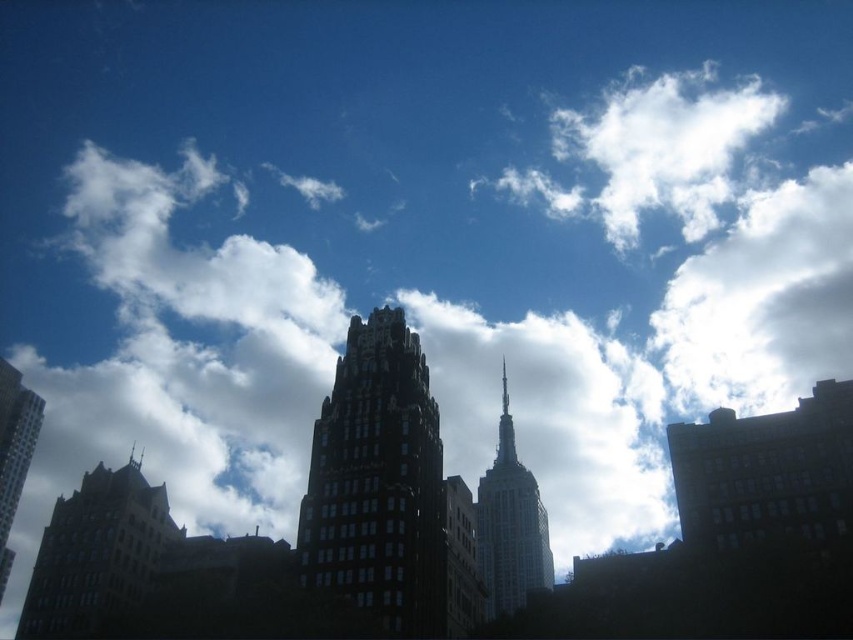
You are a drone operator who needs to deliver a package between the white glass tower at center and the dark glass skyscraper at left. The drone has a maximum flight range of 70 meters. Can the drone complete the delivery without needing a recharge?

The white glass tower at center is 73.18 meters away from the dark glass skyscraper at left. Since the drone can only fly 70 meters before needing a recharge, it cannot complete the delivery in one trip without recharging.

You are a drone operator who needs to deliver a package to the dark glass skyscraper at center. The drone has a maximum flight range of 70 meters. Can the drone reach the skyscraper?

The distance between the dark glass skyscraper at center and the camera is 64.53 meters, which is within the drone operator maximum flight range of 70 meters. The drone can reach the dark glass skyscraper at center.